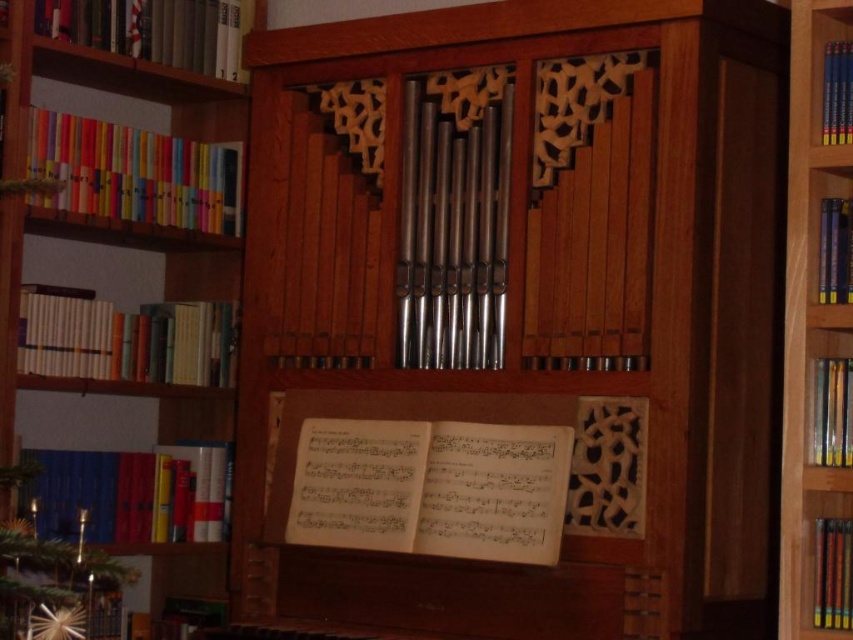
You are organizing a library and need to place the wooden bookcase at left and the blue hardcover books at right. Given their sizes, which one should be placed in a larger storage area?

The wooden bookcase at left has a larger size compared to blue hardcover books at right, so it requires a larger storage area.

You are a librarian who needs to move the blue hardcover books at right to the wooden bookcase at left. Given that you can carry one book at a time and each trip takes 10 seconds, how many seconds will it take to move all the books if there are 6 books?

The wooden bookcase at left and blue hardcover books at right are 2.17 meters apart. Moving 6 books would require 6 trips, each taking 10 seconds, totaling 60 seconds.

You are a librarian who needs to place a new book on the shelf. The blue hardcover books at right are part of a collection that requires stacking. Considering the height of the wooden pipe organ at center, can you safely add another book to the stack without exceeding the height limit?

The wooden pipe organ at center is much taller than the blue hardcover books at right, so adding another book to the stack should be safe as the books are still shorter than the organ.